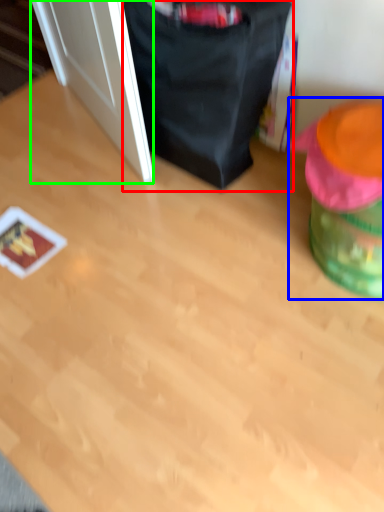
Question: Which is farther away from bean bag chair (highlighted by a red box)? bean bag chair (highlighted by a blue box) or door (highlighted by a green box)?

Choices:
 (A) bean bag chair
 (B) door

Answer: (A)